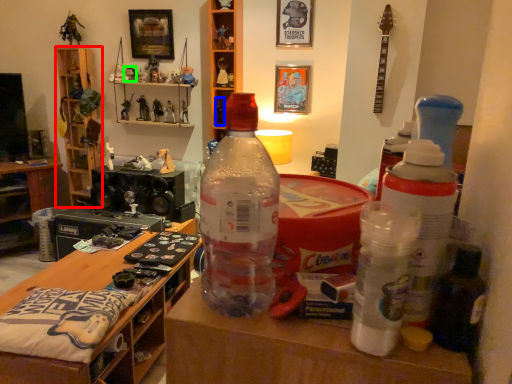
Question: Based on their relative distances, which object is nearer to shelf (highlighted by a red box)? Choose from toy (highlighted by a blue box) and toy (highlighted by a green box).

Choices:
 (A) toy
 (B) toy

Answer: (B)